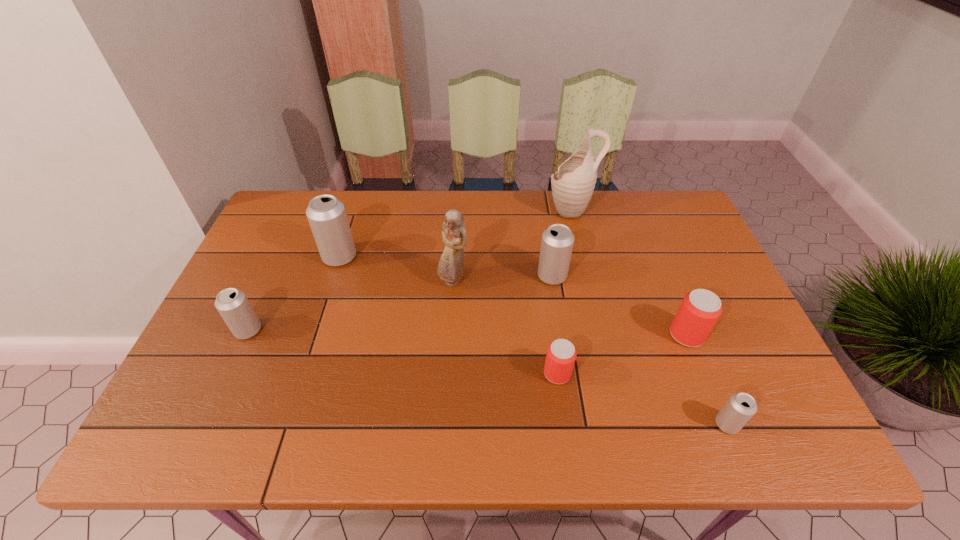
Locate an element on the screen. This screenshot has width=960, height=540. vacant point located on the front of the biggest white beer can is located at coordinates (327, 295).

The width and height of the screenshot is (960, 540). I want to click on free space located 0.210m on the front of the second biggest white beer can, so click(564, 350).

Find the location of a particular element. The image size is (960, 540). vacant space located on the front of the farther red beer can is located at coordinates (700, 366).

Locate an element on the screen. free space located on the back of the leftmost object is located at coordinates (259, 305).

At what (x,y) coordinates should I click in order to perform the action: click on vacant point located 0.100m on the back of the second nearest beer can. Please return your answer as a coordinate pair (x, y). Looking at the image, I should click on tap(551, 328).

You are a GUI agent. You are given a task and a screenshot of the screen. Output one action in this format:
    pyautogui.click(x=<x>, y=<y>)
    Task: Click on the vacant area situated 0.100m on the right of the rightmost white beer can
    This screenshot has width=960, height=540.
    Given the screenshot: What is the action you would take?
    (x=785, y=424)

Identify the location of object that is at the far edge. tap(573, 184).

Locate an element on the screen. The width and height of the screenshot is (960, 540). object present at the near edge is located at coordinates (739, 409).

Find the location of a particular element. object that is at the left edge is located at coordinates (232, 304).

Locate an element on the screen. object that is at the near right corner is located at coordinates (739, 409).